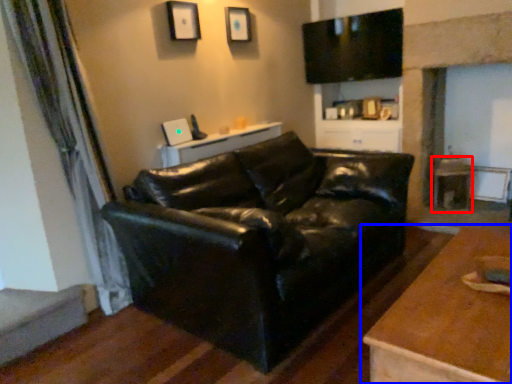
Question: Which point is closer to the camera, side table (highlighted by a red box) or table (highlighted by a blue box)?

Choices:
 (A) side table
 (B) table

Answer: (B)